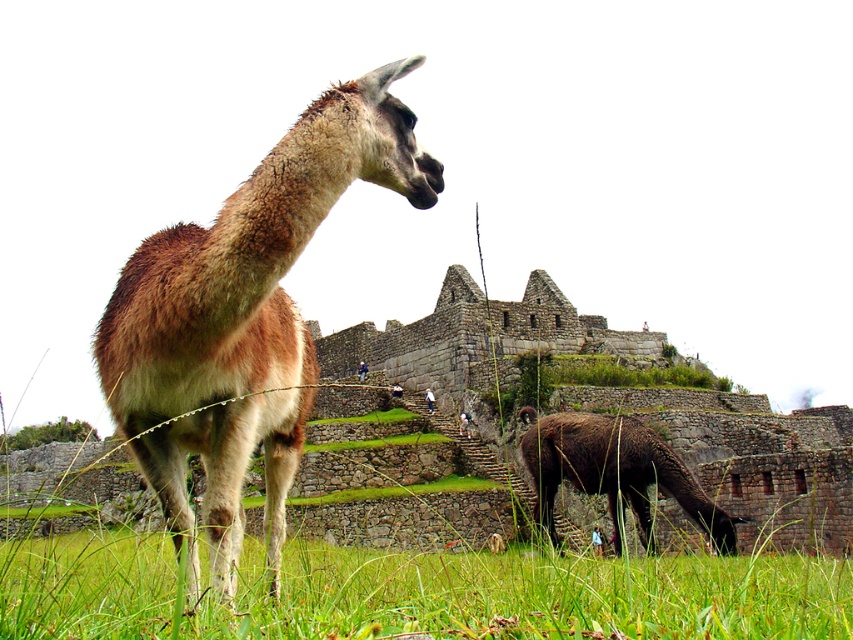
Question: Can you confirm if brown woolen alpaca at center is positioned to the right of brown woolen camel at lower right?

Choices:
 (A) no
 (B) yes

Answer: (A)

Question: Which of the following is the closest to the observer?

Choices:
 (A) brown woolen alpaca at center
 (B) brown woolen camel at lower right

Answer: (A)

Question: Is brown woolen alpaca at center above brown woolen camel at lower right?

Choices:
 (A) no
 (B) yes

Answer: (B)

Question: Is brown woolen alpaca at center positioned at the back of brown woolen camel at lower right?

Choices:
 (A) no
 (B) yes

Answer: (A)

Question: Among these objects, which one is farthest from the camera?

Choices:
 (A) brown woolen camel at lower right
 (B) brown woolen alpaca at center

Answer: (A)